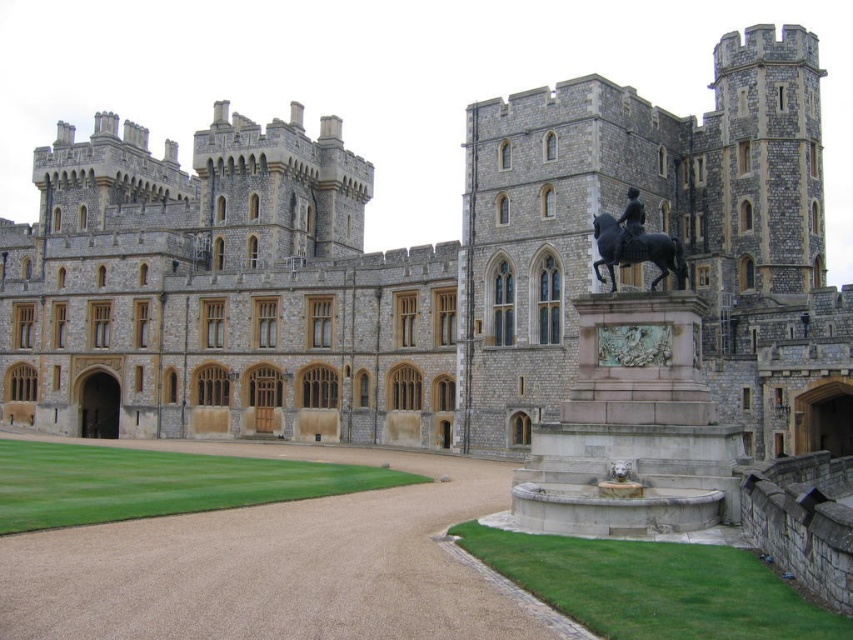
Is gray stone castle at center to the left of polished bronze statue at center-right from the viewer's perspective?

Correct, you'll find gray stone castle at center to the left of polished bronze statue at center-right.

Is point (257, 384) positioned in front of point (671, 260)?

No, it is behind (671, 260).

I want to click on gray stone castle at center, so click(x=422, y=269).